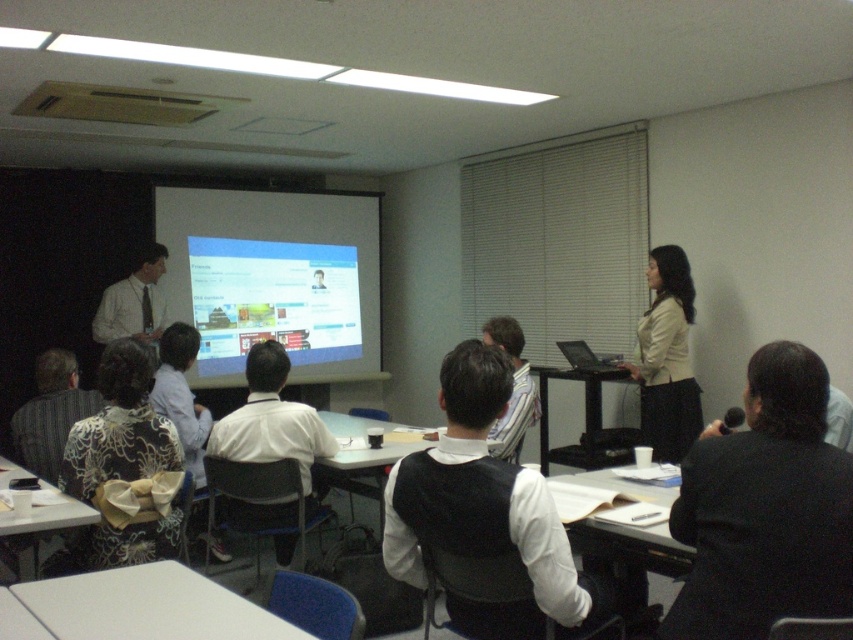
Question: Based on their relative distances, which object is nearer to the white shirt at center?

Choices:
 (A) matte white shirt at center
 (B) black plastic table at center
 (C) striped fabric shirt at center

Answer: (C)

Question: Estimate the real-world distances between objects in this image. Which object is closer to the striped fabric shirt at center?

Choices:
 (A) white plastic table at center
 (B) white plastic table at lower left
 (C) striped fabric shirt at lower left

Answer: (A)

Question: Can you confirm if striped fabric shirt at lower left is smaller than white plastic table at lower left?

Choices:
 (A) no
 (B) yes

Answer: (B)

Question: Which object is the farthest from the patterned fabric bag at center?

Choices:
 (A) white shirt at center
 (B) beige fabric jacket at center

Answer: (B)

Question: Can you confirm if black matte vest at center is wider than matte white shirt at center?

Choices:
 (A) yes
 (B) no

Answer: (A)

Question: Is white matte projection screen at center to the left of striped fabric shirt at lower left from the viewer's perspective?

Choices:
 (A) no
 (B) yes

Answer: (A)